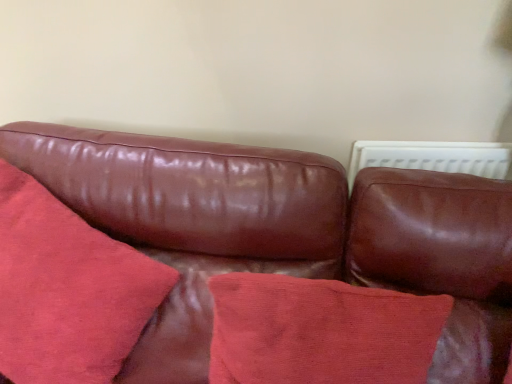
In order to face cotton cushion at center, the 1th throw pillow in the right-to-left sequence, should I rotate leftwards or rightwards?

To align with it, rotate right about 8.686°.

Image resolution: width=512 pixels, height=384 pixels. What do you see at coordinates (320, 332) in the screenshot?
I see `cotton cushion at center, the 1th throw pillow in the right-to-left sequence` at bounding box center [320, 332].

The height and width of the screenshot is (384, 512). I want to click on leather couch at center, so click(x=191, y=217).

Looking at this image, how many degrees apart are the facing directions of cotton cushion at center, which is the second throw pillow from left to right, and leather couch at center?

There is a 1.06-degree angle between the facing directions of cotton cushion at center, which is the second throw pillow from left to right, and leather couch at center.

Considering the sizes of objects cotton cushion at center, the 1th throw pillow in the right-to-left sequence, and leather couch at center in the image provided, who is taller, cotton cushion at center, the 1th throw pillow in the right-to-left sequence, or leather couch at center?

leather couch at center.

Is cotton cushion at center, the 1th throw pillow in the right-to-left sequence, aimed at leather couch at center?

Yes, cotton cushion at center, the 1th throw pillow in the right-to-left sequence, is oriented towards leather couch at center.

Does cotton cushion at center, the 1th throw pillow in the right-to-left sequence, have a larger size compared to leather couch at center?

No.

From the picture: Between leather couch at center and cotton cushion at center, the 1th throw pillow in the right-to-left sequence, which one has less height?

cotton cushion at center, the 1th throw pillow in the right-to-left sequence.

Is leather couch at center smaller than cotton cushion at center, the 1th throw pillow in the right-to-left sequence?

No, leather couch at center is not smaller than cotton cushion at center, the 1th throw pillow in the right-to-left sequence.

From a real-world perspective, is leather couch at center over cotton cushion at center, which is the second throw pillow from left to right?

No, from a real-world perspective, leather couch at center is not above cotton cushion at center, which is the second throw pillow from left to right.

Based on the photo, considering the relative positions of leather couch at center and cotton cushion at center, the 1th throw pillow in the right-to-left sequence, in the image provided, is leather couch at center to the right of cotton cushion at center, the 1th throw pillow in the right-to-left sequence, from the viewer's perspective?

In fact, leather couch at center is to the left of cotton cushion at center, the 1th throw pillow in the right-to-left sequence.

Locate an element on the screen. This screenshot has height=384, width=512. throw pillow on the left of cotton cushion at center, which is the second throw pillow from left to right is located at coordinates (67, 290).

Considering the relative sizes of suede-like red pillow at center, which is the 1th throw pillow from left to right, and cotton cushion at center, which is the second throw pillow from left to right, in the image provided, is suede-like red pillow at center, which is the 1th throw pillow from left to right, taller than cotton cushion at center, which is the second throw pillow from left to right,?

Indeed, suede-like red pillow at center, which is the 1th throw pillow from left to right, has a greater height compared to cotton cushion at center, which is the second throw pillow from left to right.

Can you confirm if suede-like red pillow at center, which is the 1th throw pillow from left to right, is wider than cotton cushion at center, the 1th throw pillow in the right-to-left sequence?

Yes.

How much distance is there between suede-like red pillow at center, which is the 2th throw pillow in right-to-left order, and cotton cushion at center, which is the second throw pillow from left to right?

suede-like red pillow at center, which is the 2th throw pillow in right-to-left order, is 33.76 centimeters from cotton cushion at center, which is the second throw pillow from left to right.

Locate an element on the screen. This screenshot has height=384, width=512. throw pillow on the right of suede-like red pillow at center, which is the 1th throw pillow from left to right is located at coordinates (320, 332).

Who is taller, cotton cushion at center, which is the second throw pillow from left to right, or suede-like red pillow at center, which is the 2th throw pillow in right-to-left order?

suede-like red pillow at center, which is the 2th throw pillow in right-to-left order, is taller.

Is the position of cotton cushion at center, the 1th throw pillow in the right-to-left sequence, more distant than that of suede-like red pillow at center, which is the 1th throw pillow from left to right?

Yes, cotton cushion at center, the 1th throw pillow in the right-to-left sequence, is further from the camera.

Is suede-like red pillow at center, which is the 1th throw pillow from left to right, positioned with its back to leather couch at center?

That's right, suede-like red pillow at center, which is the 1th throw pillow from left to right, is facing away from leather couch at center.

From the picture: Can you confirm if suede-like red pillow at center, which is the 1th throw pillow from left to right, is wider than leather couch at center?

No.

Does point (76, 350) lie behind point (319, 160)?

No, (76, 350) is closer to viewer.

Which of these two, suede-like red pillow at center, which is the 1th throw pillow from left to right, or leather couch at center, is bigger?

leather couch at center.

Relative to suede-like red pillow at center, which is the 1th throw pillow from left to right, is leather couch at center in front or behind?

leather couch at center is positioned closer to the viewer than suede-like red pillow at center, which is the 1th throw pillow from left to right.

Is leather couch at center positioned with its back to suede-like red pillow at center, which is the 1th throw pillow from left to right?

That's right, leather couch at center is facing away from suede-like red pillow at center, which is the 1th throw pillow from left to right.

Between point (446, 239) and point (47, 334), which one is positioned in front?

Positioned in front is point (446, 239).

This screenshot has height=384, width=512. Identify the location of studio couch lying on the left of cotton cushion at center, the 1th throw pillow in the right-to-left sequence. (191, 217).

Locate an element on the screen. the 2nd throw pillow behind when counting from the leather couch at center is located at coordinates (320, 332).

Estimate the real-world distances between objects in this image. Which object is closer to leather couch at center, cotton cushion at center, the 1th throw pillow in the right-to-left sequence, or suede-like red pillow at center, which is the 1th throw pillow from left to right?

Answer: cotton cushion at center, the 1th throw pillow in the right-to-left sequence, is positioned closer to the anchor leather couch at center.

Looking at the image, which one is located closer to leather couch at center, suede-like red pillow at center, which is the 2th throw pillow in right-to-left order, or cotton cushion at center, which is the second throw pillow from left to right?

cotton cushion at center, which is the second throw pillow from left to right, is positioned closer to the anchor leather couch at center.

Which object lies nearer to the anchor point suede-like red pillow at center, which is the 2th throw pillow in right-to-left order, leather couch at center or cotton cushion at center, the 1th throw pillow in the right-to-left sequence?

Among the two, leather couch at center is located nearer to suede-like red pillow at center, which is the 2th throw pillow in right-to-left order.

Which object lies further to the anchor point suede-like red pillow at center, which is the 1th throw pillow from left to right, cotton cushion at center, the 1th throw pillow in the right-to-left sequence, or leather couch at center?

cotton cushion at center, the 1th throw pillow in the right-to-left sequence, is positioned further to the anchor suede-like red pillow at center, which is the 1th throw pillow from left to right.

Looking at the image, which one is located further to cotton cushion at center, which is the second throw pillow from left to right, leather couch at center or suede-like red pillow at center, which is the 1th throw pillow from left to right?

suede-like red pillow at center, which is the 1th throw pillow from left to right, lies further to cotton cushion at center, which is the second throw pillow from left to right, than the other object.

Based on their spatial positions, is suede-like red pillow at center, which is the 2th throw pillow in right-to-left order, or leather couch at center closer to cotton cushion at center, the 1th throw pillow in the right-to-left sequence?

leather couch at center is closer to cotton cushion at center, the 1th throw pillow in the right-to-left sequence.

The height and width of the screenshot is (384, 512). In order to click on studio couch situated between suede-like red pillow at center, which is the 1th throw pillow from left to right, and cotton cushion at center, the 1th throw pillow in the right-to-left sequence, from left to right in this screenshot , I will do `click(191, 217)`.